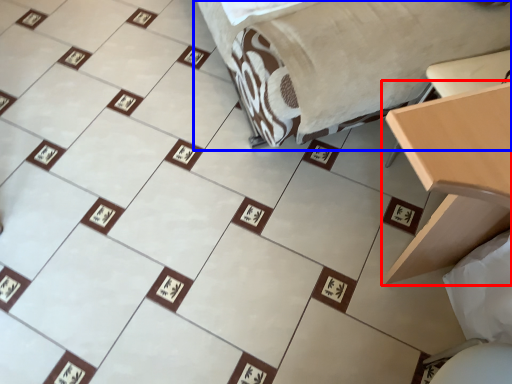
Question: Among these objects, which one is nearest to the camera, table (highlighted by a red box) or furniture (highlighted by a blue box)?

Choices:
 (A) table
 (B) furniture

Answer: (A)